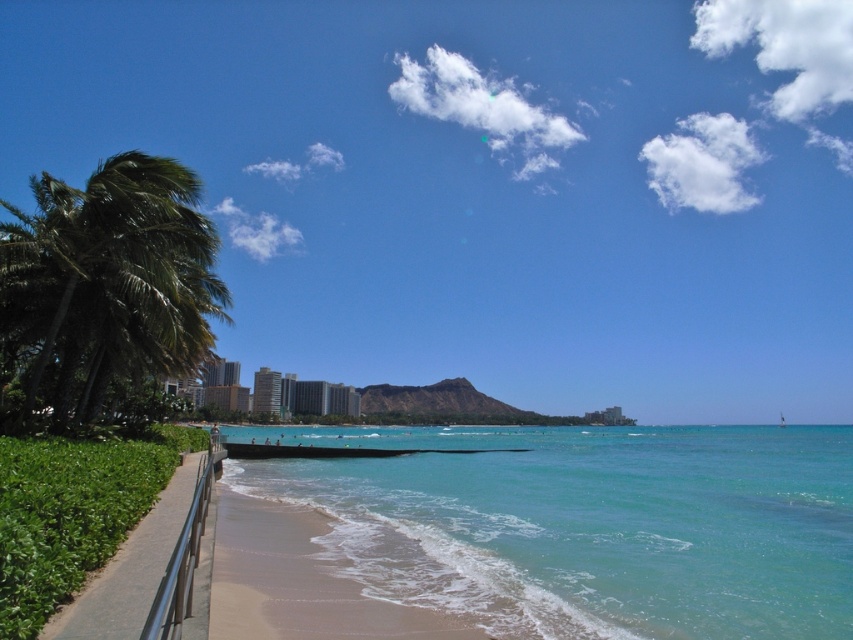
Between transparent blue sky at upper center and light brown sand at lower center, which one is positioned lower?

Positioned lower is light brown sand at lower center.

Does transparent blue sky at upper center have a smaller size compared to light brown sand at lower center?

Incorrect, transparent blue sky at upper center is not smaller in size than light brown sand at lower center.

Which is behind, point (595, 109) or point (222, 577)?

Positioned behind is point (595, 109).

The image size is (853, 640). I want to click on transparent blue sky at upper center, so click(488, 186).

The width and height of the screenshot is (853, 640). Describe the element at coordinates (108, 280) in the screenshot. I see `green leafy palm tree at left` at that location.

You are a GUI agent. You are given a task and a screenshot of the screen. Output one action in this format:
    pyautogui.click(x=<x>, y=<y>)
    Task: Click on the green leafy palm tree at left
    The image size is (853, 640).
    Given the screenshot: What is the action you would take?
    pyautogui.click(x=108, y=280)

Between point (134, 316) and point (276, 588), which one is positioned behind?

The point (134, 316) is behind.

You are a GUI agent. You are given a task and a screenshot of the screen. Output one action in this format:
    pyautogui.click(x=<x>, y=<y>)
    Task: Click on the green leafy palm tree at left
    The width and height of the screenshot is (853, 640).
    Given the screenshot: What is the action you would take?
    pyautogui.click(x=108, y=280)

Between clear blue water at lower center and light brown sand at lower center, which one has more height?

With more height is clear blue water at lower center.

Describe the element at coordinates (587, 525) in the screenshot. I see `clear blue water at lower center` at that location.

Where is `clear blue water at lower center`? This screenshot has width=853, height=640. clear blue water at lower center is located at coordinates (587, 525).